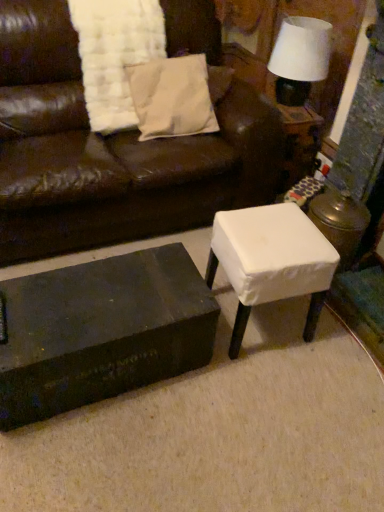
Question: Is white fabric stool at center inside white fabric-covered stool at right?

Choices:
 (A) no
 (B) yes

Answer: (A)

Question: From a real-world perspective, is white fabric-covered stool at right located beneath white fabric stool at center?

Choices:
 (A) yes
 (B) no

Answer: (A)

Question: Is white fabric-covered stool at right facing towards white fabric stool at center?

Choices:
 (A) no
 (B) yes

Answer: (A)

Question: Considering the relative sizes of white fabric-covered stool at right and white fabric stool at center in the image provided, is white fabric-covered stool at right shorter than white fabric stool at center?

Choices:
 (A) no
 (B) yes

Answer: (B)

Question: Does white fabric-covered stool at right appear on the left side of white fabric stool at center?

Choices:
 (A) no
 (B) yes

Answer: (A)

Question: Considering the relative sizes of white fabric-covered stool at right and white fabric stool at center in the image provided, is white fabric-covered stool at right smaller than white fabric stool at center?

Choices:
 (A) yes
 (B) no

Answer: (A)

Question: Is white cotton pillow at upper center located within white textured blanket at upper left?

Choices:
 (A) yes
 (B) no

Answer: (B)

Question: Does white textured blanket at upper left have a greater width compared to white cotton pillow at upper center?

Choices:
 (A) yes
 (B) no

Answer: (A)

Question: Is white cotton pillow at upper center at the back of white textured blanket at upper left?

Choices:
 (A) yes
 (B) no

Answer: (B)

Question: Is the position of white textured blanket at upper left less distant than that of white cotton pillow at upper center?

Choices:
 (A) yes
 (B) no

Answer: (A)

Question: From the image's perspective, is white textured blanket at upper left under white cotton pillow at upper center?

Choices:
 (A) yes
 (B) no

Answer: (B)

Question: Is white textured blanket at upper left smaller than white cotton pillow at upper center?

Choices:
 (A) yes
 (B) no

Answer: (B)

Question: Is white fabric lampshade at upper right in front of white fabric-covered stool at right?

Choices:
 (A) yes
 (B) no

Answer: (A)